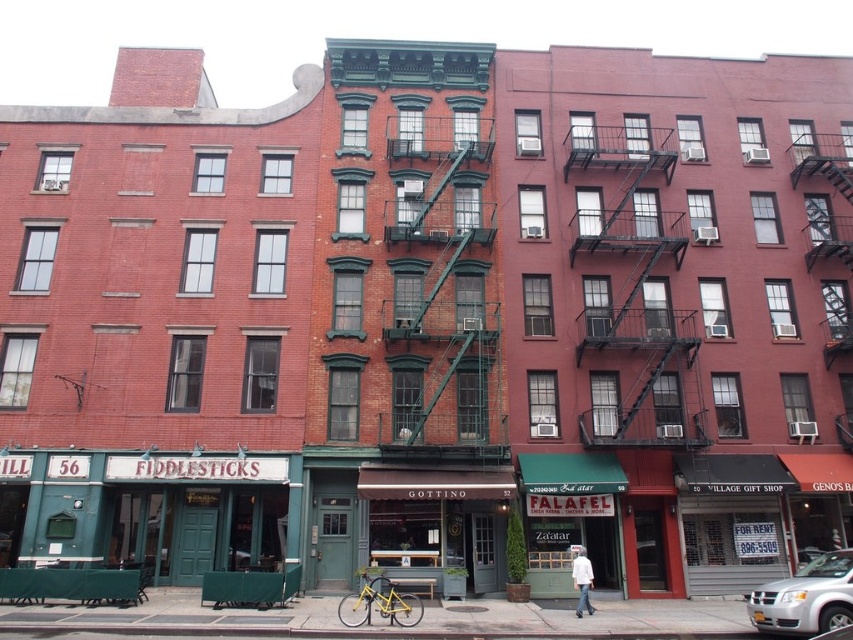
Question: Among these objects, which one is farthest from the camera?

Choices:
 (A) yellow matte bicycle at center
 (B) silver metallic van at lower right
 (C) white cotton shirt at center

Answer: (C)

Question: Is yellow matte bicycle at center to the left of white cotton shirt at center from the viewer's perspective?

Choices:
 (A) yes
 (B) no

Answer: (A)

Question: Among these points, which one is nearest to the camera?

Choices:
 (A) (584, 595)
 (B) (366, 589)
 (C) (845, 595)

Answer: (C)

Question: Which object is positioned closest to the silver metallic van at lower right?

Choices:
 (A) yellow matte bicycle at center
 (B) white cotton shirt at center

Answer: (B)

Question: Does silver metallic van at lower right have a greater width compared to yellow matte bicycle at center?

Choices:
 (A) no
 (B) yes

Answer: (B)

Question: Where is silver metallic van at lower right located in relation to white cotton shirt at center in the image?

Choices:
 (A) left
 (B) right

Answer: (B)